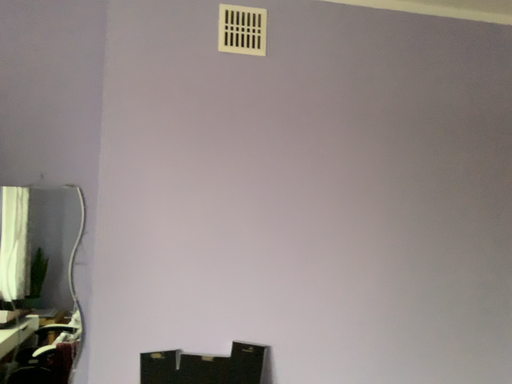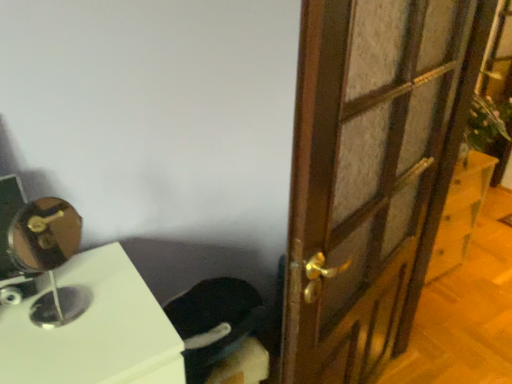
Question: Which way did the camera rotate in the video?

Choices:
 (A) rotated upward
 (B) rotated downward

Answer: (B)